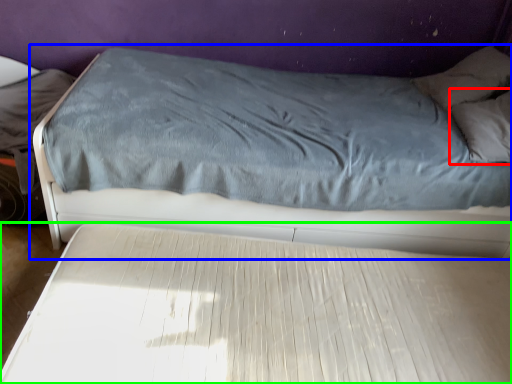
Question: Considering the real-world distances, which object is closest to pillow (highlighted by a red box)? bed (highlighted by a blue box) or bed (highlighted by a green box).

Choices:
 (A) bed
 (B) bed

Answer: (A)